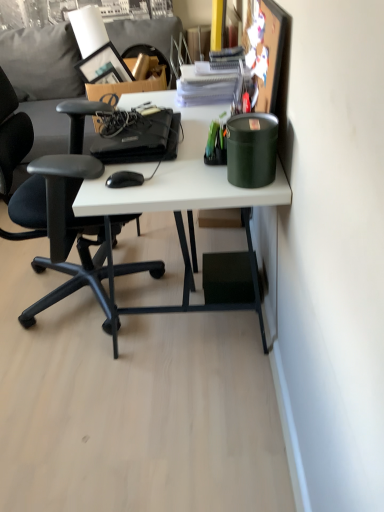
Question: From the image's perspective, is black matte laptop at center located above or below black plastic mouse at center?

Choices:
 (A) above
 (B) below

Answer: (A)

Question: Is black matte laptop at center bigger or smaller than black plastic mouse at center?

Choices:
 (A) small
 (B) big

Answer: (B)

Question: Which object is the closest to the white matte desk at center?

Choices:
 (A) green matte canister at upper right
 (B) black plastic mouse at center
 (C) dark gray fabric couch at upper left
 (D) black matte laptop at center

Answer: (D)

Question: Which of these objects is positioned farthest from the dark gray fabric couch at upper left?

Choices:
 (A) white matte desk at center
 (B) green matte canister at upper right
 (C) black plastic mouse at center
 (D) black matte laptop at center

Answer: (C)